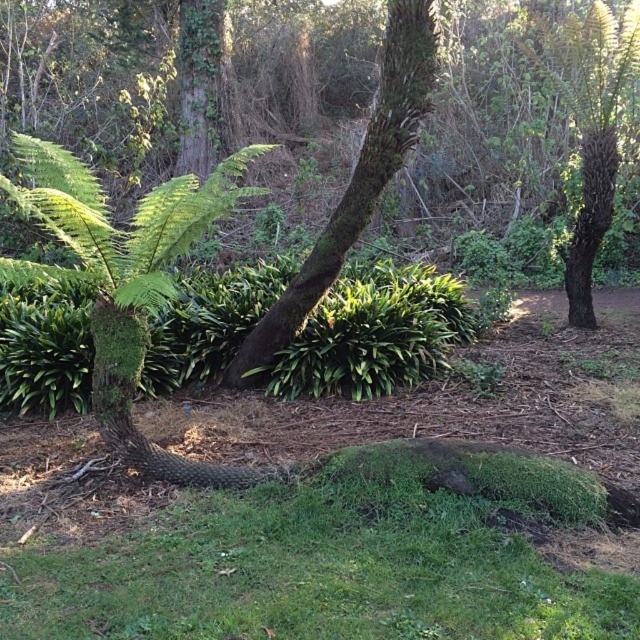
You are a hiker trying to navigate through the forest. You see the green mossy bark tree at center and the green mossy tree at upper right. Which tree should you approach first if you want to reach the one nearest to you?

You should approach the green mossy bark tree at center first because it is closer to you than the green mossy tree at upper right.

You are a hiker who wants to take a photo of the green mossy tree at upper right. You are currently standing on the green mossy grass at lower center. Which direction should you move to get a better view of the tree?

Since the green mossy grass at lower center is located below the green mossy tree at upper right, you should move forward or upwards to get a better view of the green mossy tree at upper right.

You are a hiker trying to cross a narrow path between the green mossy grass at lower center and the green mossy bark tree at center. Can your backpack fit through the space between them?

The green mossy grass at lower center is wider than the green mossy bark tree at center, so the space between them may be sufficient for your backpack to pass through, depending on its size.